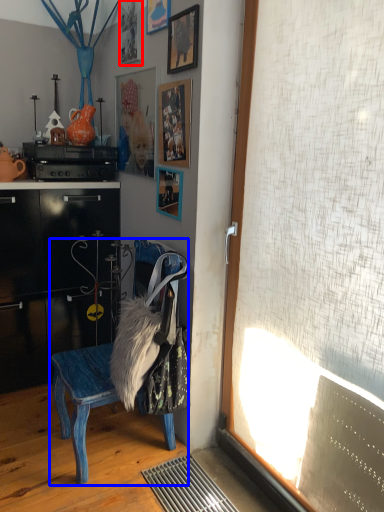
Question: Which object is closer to the camera taking this photo, picture frame (highlighted by a red box) or chair (highlighted by a blue box)?

Choices:
 (A) picture frame
 (B) chair

Answer: (B)